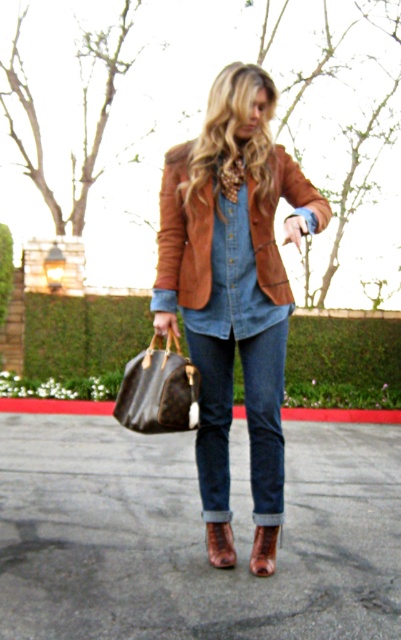
Which is below, suede brown blazer at center or brown leather handbag at lower left?

brown leather handbag at lower left is lower down.

Between point (202, 458) and point (162, 349), which one is positioned in front?

Positioned in front is point (162, 349).

Between point (176, 186) and point (125, 413), which one is positioned in front?

Point (125, 413)

Locate an element on the screen. suede brown blazer at center is located at coordinates (234, 276).

Identify the location of brown leather jacket at center. (184, 236).

Looking at this image, is brown leather jacket at center positioned at the back of leather boot at lower center?

That is False.

Which is behind, point (160, 305) or point (249, 570)?

Positioned behind is point (249, 570).

Find the location of `brown leather jacket at center`. brown leather jacket at center is located at coordinates click(184, 236).

Who is taller, denim jeans at center or brown leather handbag at lower left?

denim jeans at center is taller.

Can you confirm if denim jeans at center is positioned below brown leather handbag at lower left?

Correct, denim jeans at center is located below brown leather handbag at lower left.

Where is `denim jeans at center`? The height and width of the screenshot is (640, 401). denim jeans at center is located at coordinates (x=265, y=419).

Find the location of a particular element. denim jeans at center is located at coordinates (265, 419).